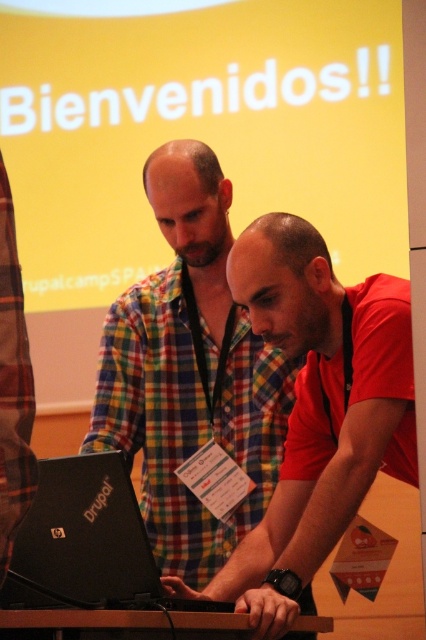
Consider the image. Who is positioned more to the right, red matte shirt at center or brown wooden table at lower center?

red matte shirt at center is more to the right.

Is red matte shirt at center wider than brown wooden table at lower center?

In fact, red matte shirt at center might be narrower than brown wooden table at lower center.

I want to click on red matte shirt at center, so click(316, 410).

Is point (218, 429) positioned in front of point (261, 257)?

No, it is not.

Does multicolored plaid shirt at center have a lesser width compared to red matte shirt at center?

No.

The width and height of the screenshot is (426, 640). I want to click on multicolored plaid shirt at center, so click(189, 371).

Find the location of a particular element. The width and height of the screenshot is (426, 640). multicolored plaid shirt at center is located at coordinates coord(189,371).

Who is lower down, multicolored plaid shirt at center or black matte laptop at center?

black matte laptop at center is below.

Between point (282, 396) and point (71, 481), which one is positioned in front?

Positioned in front is point (71, 481).

Does point (135, 316) lie in front of point (39, 484)?

No, it is not.

The height and width of the screenshot is (640, 426). I want to click on multicolored plaid shirt at center, so click(189, 371).